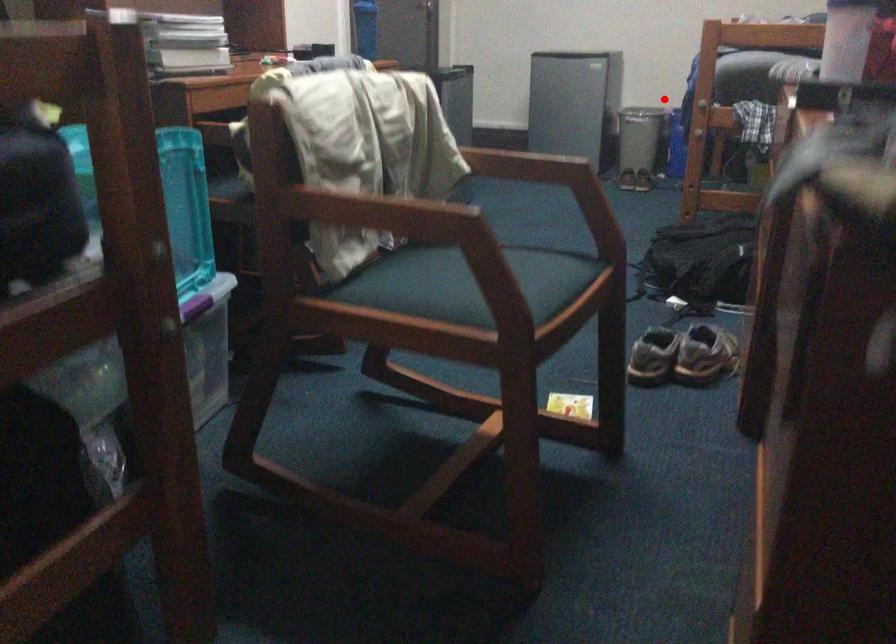
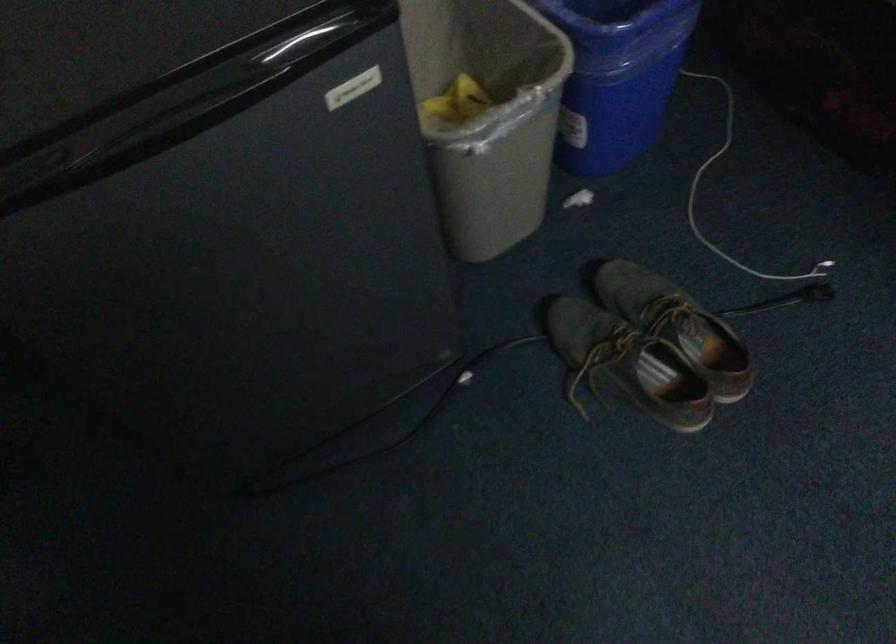
Locate, in the second image, the point that corresponds to the highlighted location in the first image.

(616, 76)